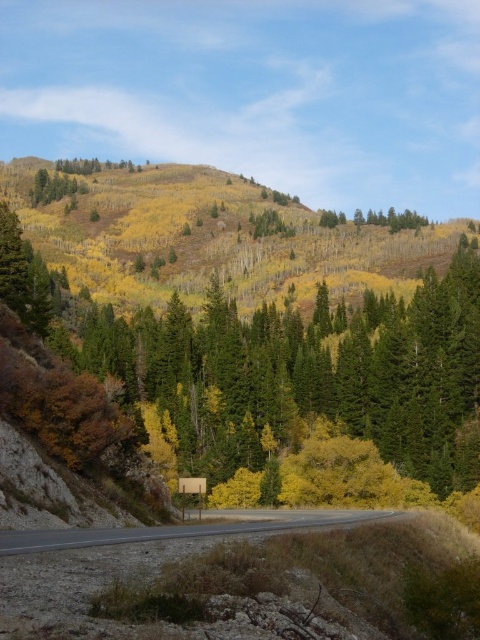
Looking at this image, you are standing at the point labeled as point (170,531) in the image. Based on the scene description, what type of surface are you most likely standing on?

The point (170,531) corresponds to the gray asphalt road at center, so you are most likely standing on asphalt.

From the picture: You are standing at the starting point of the road in the foreground. You see two points marked in the image. Which point is closer to you, point (308, 522) or point (186, 486)?

Point (308, 522) is in front of point (186, 486), so it is closer to you.

You are a hiker planning to take a photo of the gray asphalt road at center and the metallic yellow street sign at center. Which object should you focus on first if you want both to be in sharp focus, considering their sizes?

The gray asphalt road at center has a larger size compared to metallic yellow street sign at center, so you should focus on the gray asphalt road at center first to ensure both are in sharp focus.